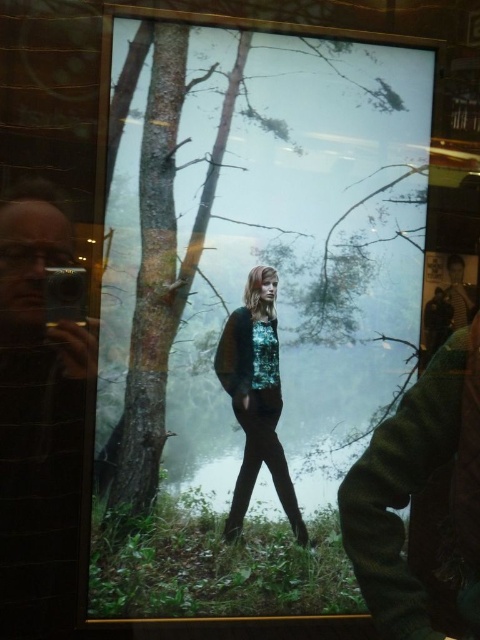
Is matte black camera at left closer to the viewer compared to shiny teal blouse at center?

Yes.

Which is above, matte black camera at left or shiny teal blouse at center?

Positioned higher is matte black camera at left.

Does point (15, 371) lie behind point (229, 381)?

No, it is in front of (229, 381).

At what (x,y) coordinates should I click in order to perform the action: click on matte black camera at left. Please return your answer as a coordinate pair (x, y). The width and height of the screenshot is (480, 640). Looking at the image, I should click on (38, 420).